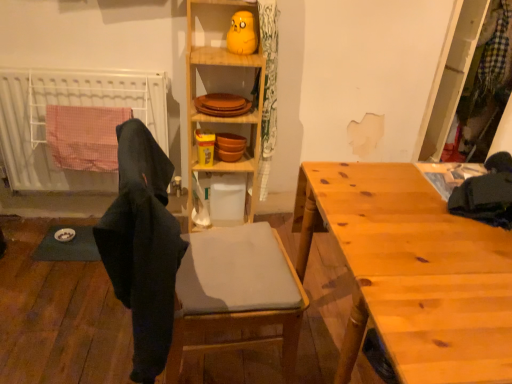
Question: Would you say wooden table at right is inside or outside white plastic radiator at left?

Choices:
 (A) outside
 (B) inside

Answer: (A)

Question: Based on their sizes in the image, would you say wooden table at right is bigger or smaller than white plastic radiator at left?

Choices:
 (A) small
 (B) big

Answer: (B)

Question: Estimate the real-world distances between objects in this image. Which object is farther from the matte yellow rubber duck at upper center?

Choices:
 (A) white plastic radiator at left
 (B) wooden cabinet at center
 (C) wooden table at right
 (D) black fabric at left
 (E) matte gray cushioned chair at center

Answer: (C)

Question: Considering the real-world distances, which object is closest to the matte gray cushioned chair at center?

Choices:
 (A) black fabric at left
 (B) wooden table at right
 (C) matte yellow rubber duck at upper center
 (D) white plastic radiator at left
 (E) wooden cabinet at center

Answer: (A)